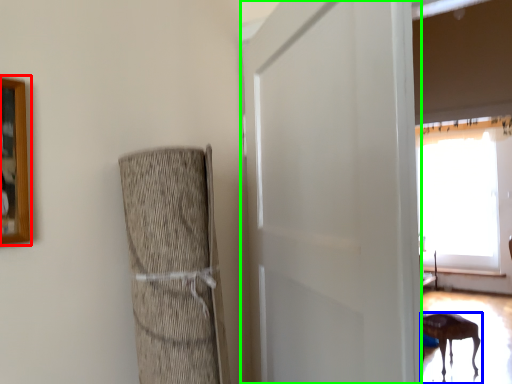
Question: Which object is positioned farthest from picture frame (highlighted by a red box)? Select from furniture (highlighted by a blue box) and screen door (highlighted by a green box).

Choices:
 (A) furniture
 (B) screen door

Answer: (A)